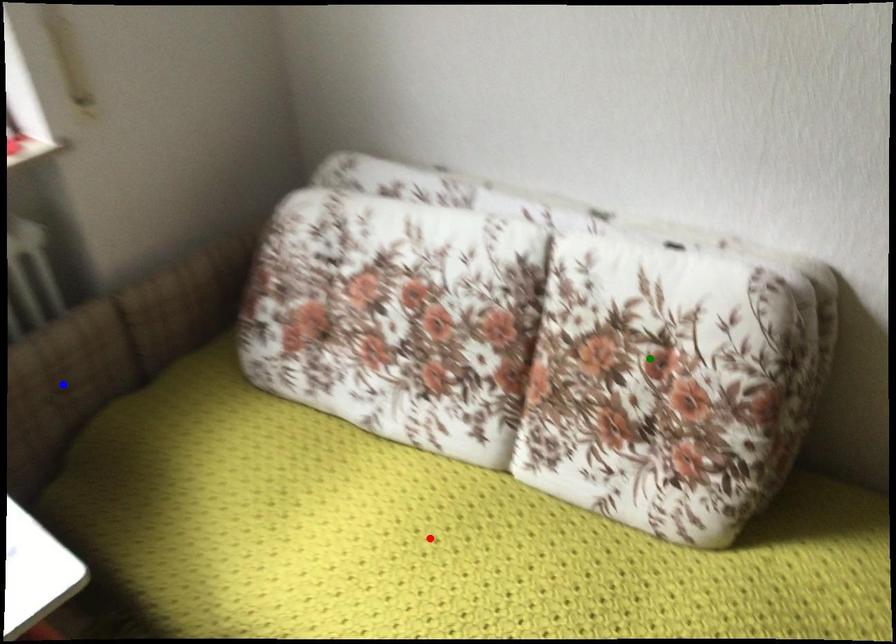
Order these from nearest to farthest:
blue point
red point
green point

blue point < red point < green point